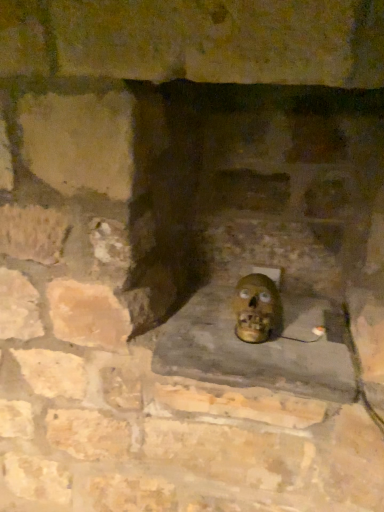
Locate an element on the screen. This screenshot has width=384, height=512. free location in front of gold metallic skull at center is located at coordinates (275, 362).